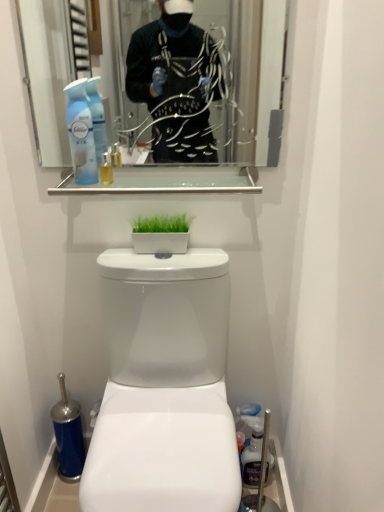
Where is `vacant space to the right of translucent plastic spray bottle at upper left`? The height and width of the screenshot is (512, 384). vacant space to the right of translucent plastic spray bottle at upper left is located at coordinates (147, 185).